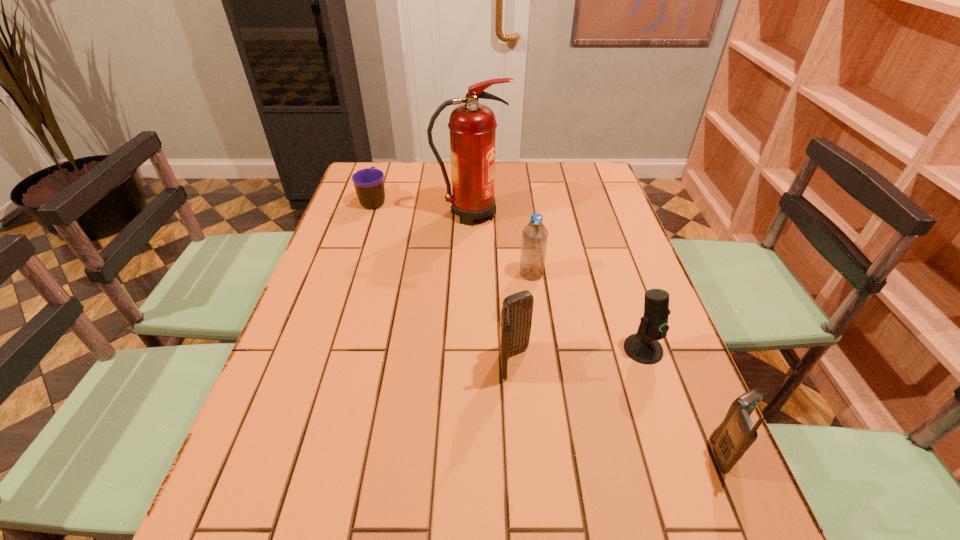
Please point a spot on the left to add another cellular telephone. Please provide its 2D coordinates. Your answer should be formatted as a tuple, i.e. [(x, y)], where the tuple contains the x and y coordinates of a point satisfying the conditions above.

[(361, 296)]